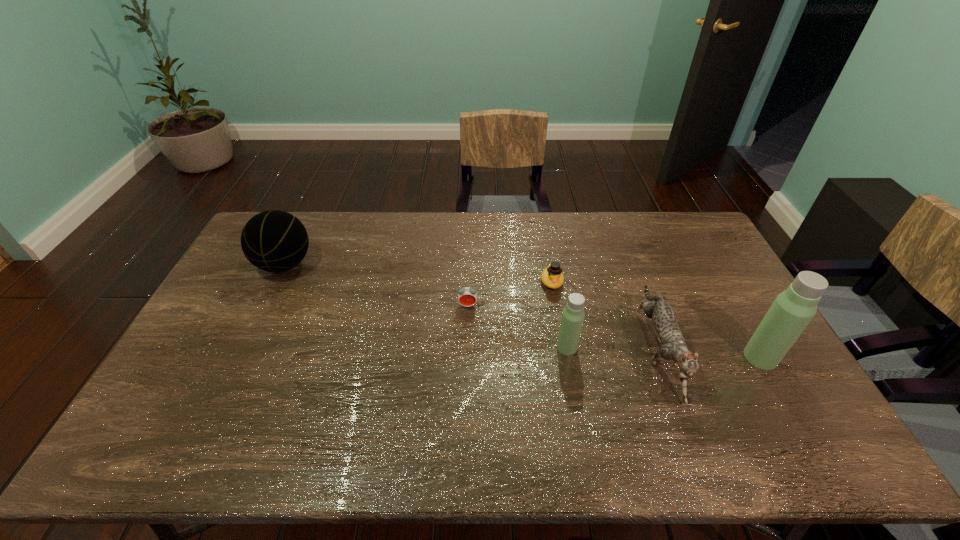
Where is `vacant space at the right edge of the desktop`? vacant space at the right edge of the desktop is located at coordinates (746, 304).

I want to click on free space at the near right corner of the desktop, so click(x=763, y=394).

The image size is (960, 540). What are the coordinates of `free space between the alarm clock and the duck` in the screenshot? It's located at pos(510,294).

The width and height of the screenshot is (960, 540). Find the location of `vacant area that lies between the duck and the fifth object from right to left`. vacant area that lies between the duck and the fifth object from right to left is located at coordinates (510, 294).

Where is `free space between the alarm clock and the duck`? This screenshot has width=960, height=540. free space between the alarm clock and the duck is located at coordinates (510, 294).

Locate an element on the screen. This screenshot has width=960, height=540. empty location between the basketball and the rightmost object is located at coordinates (522, 311).

Find the location of a particular element. The width and height of the screenshot is (960, 540). vacant space that is in between the duck and the shorter thermos bottle is located at coordinates (560, 314).

Where is `free space between the basketball and the fifth object from right to left`? free space between the basketball and the fifth object from right to left is located at coordinates (376, 285).

The width and height of the screenshot is (960, 540). Identify the location of free spot between the leftmost object and the shorter thermos bottle. (425, 306).

I want to click on vacant space that is in between the fifth object from left to right and the shorter thermos bottle, so click(x=612, y=348).